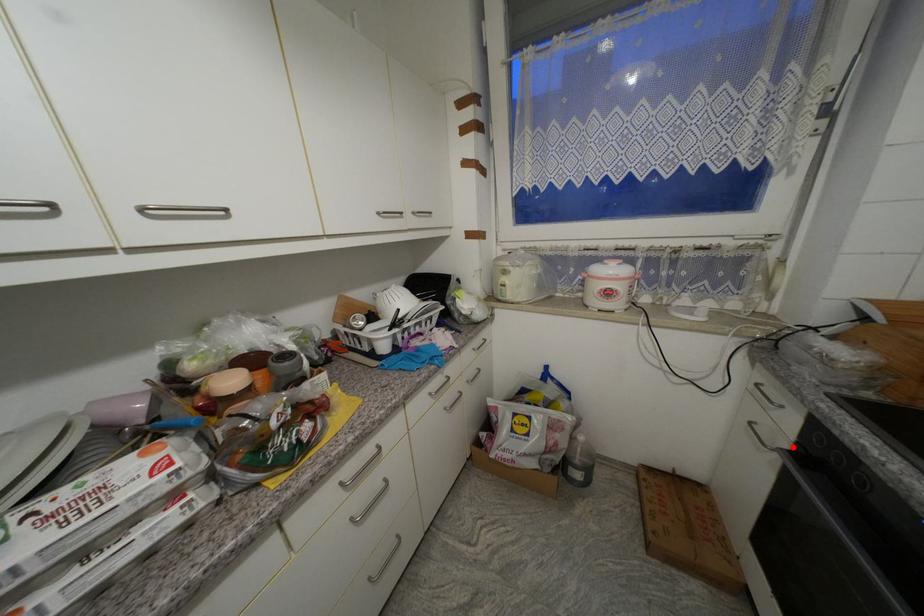
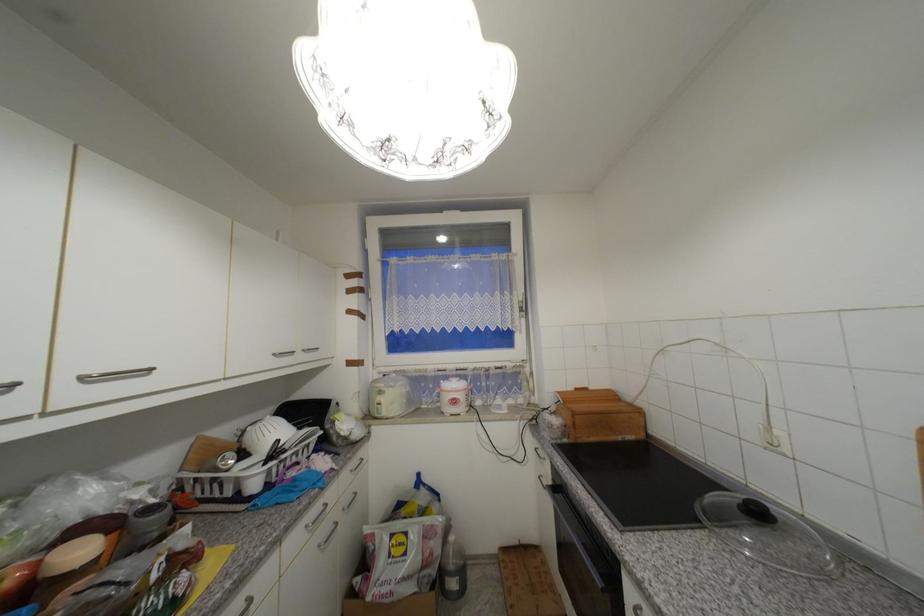
Where in the second image is the point corresponding to the highlighted location from the first image?

(555, 485)